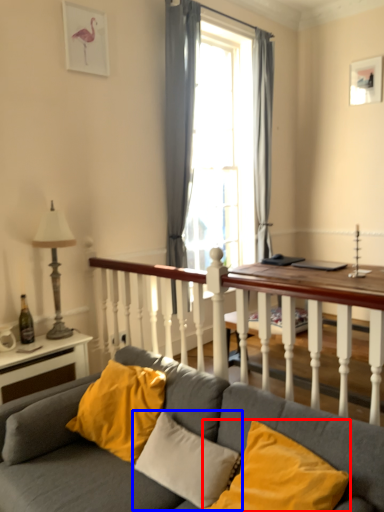
Question: Among these objects, which one is farthest to the camera, pillow (highlighted by a red box) or pillow (highlighted by a blue box)?

Choices:
 (A) pillow
 (B) pillow

Answer: (B)